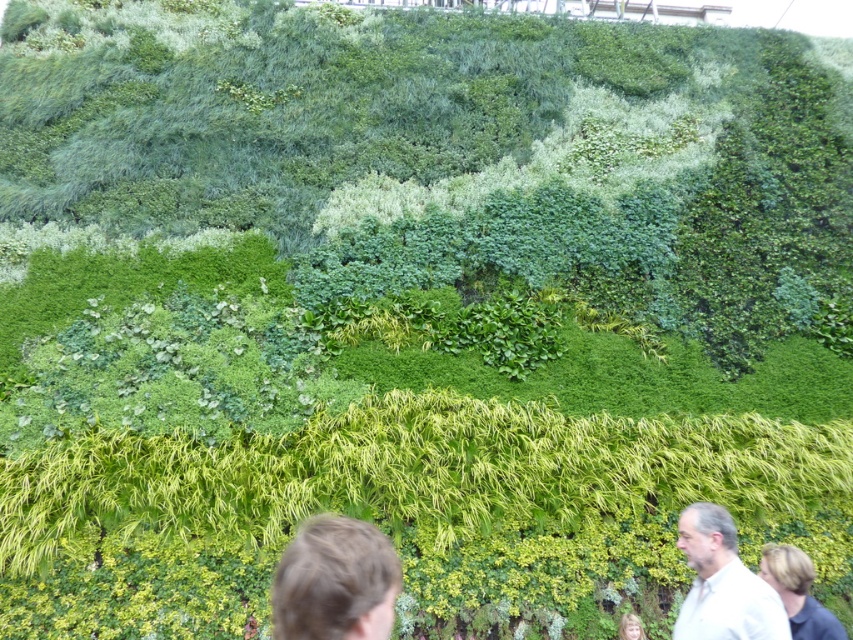
Question: Is brown hair at lower center wider than white shirt at lower right?

Choices:
 (A) no
 (B) yes

Answer: (B)

Question: Which of the following is the closest to the observer?

Choices:
 (A) (709, 611)
 (B) (329, 536)

Answer: (B)

Question: Which object appears closest to the camera in this image?

Choices:
 (A) brown hair at lower center
 (B) white shirt at lower right

Answer: (A)

Question: Among these objects, which one is farthest from the camera?

Choices:
 (A) white shirt at lower right
 (B) brown hair at lower center

Answer: (A)

Question: Does brown hair at lower center have a smaller size compared to white shirt at lower right?

Choices:
 (A) yes
 (B) no

Answer: (A)

Question: Can you confirm if brown hair at lower center is positioned above white shirt at lower right?

Choices:
 (A) no
 (B) yes

Answer: (B)